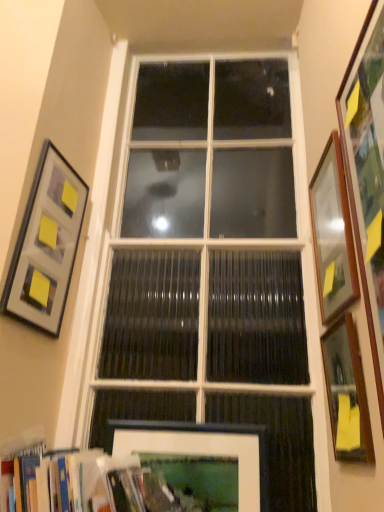
Question: Is wooden bookshelf at lower left placed right next to wooden framed mirror at right, the 2th picture frame viewed from the right?

Choices:
 (A) yes
 (B) no

Answer: (B)

Question: Is wooden bookshelf at lower left thinner than wooden framed mirror at right, the fourth picture frame in the left-to-right sequence?

Choices:
 (A) no
 (B) yes

Answer: (A)

Question: Is wooden bookshelf at lower left positioned before wooden framed mirror at right, the 2th picture frame viewed from the right?

Choices:
 (A) yes
 (B) no

Answer: (A)

Question: Is wooden bookshelf at lower left not inside wooden framed mirror at right, the fourth picture frame in the left-to-right sequence?

Choices:
 (A) yes
 (B) no

Answer: (A)

Question: Does wooden bookshelf at lower left appear on the right side of wooden framed mirror at right, the fourth picture frame in the left-to-right sequence?

Choices:
 (A) yes
 (B) no

Answer: (B)

Question: From a real-world perspective, relative to white glass window at center, is wooden picture frame at right, the third picture frame viewed from the left, vertically above or below?

Choices:
 (A) below
 (B) above

Answer: (A)

Question: From the image's perspective, is wooden picture frame at right, the third picture frame viewed from the left, above or below white glass window at center?

Choices:
 (A) below
 (B) above

Answer: (B)

Question: Considering the positions of wooden picture frame at right, the third picture frame viewed from the left, and white glass window at center in the image, is wooden picture frame at right, the third picture frame viewed from the left, wider or thinner than white glass window at center?

Choices:
 (A) thin
 (B) wide

Answer: (A)

Question: In the image, is wooden picture frame at right, the third picture frame viewed from the left, on the left side or the right side of white glass window at center?

Choices:
 (A) right
 (B) left

Answer: (A)

Question: Is wooden framed mirror at right, the 2th picture frame viewed from the right, taller or shorter than matte gray picture frame at upper left, arranged as the 5th picture frame when viewed from the right?

Choices:
 (A) short
 (B) tall

Answer: (A)

Question: Looking at their shapes, would you say wooden framed mirror at right, the 2th picture frame viewed from the right, is wider or thinner than matte gray picture frame at upper left, the first picture frame positioned from the left?

Choices:
 (A) thin
 (B) wide

Answer: (B)

Question: Considering the relative positions of wooden framed mirror at right, the 2th picture frame viewed from the right, and matte gray picture frame at upper left, arranged as the 5th picture frame when viewed from the right, in the image provided, is wooden framed mirror at right, the 2th picture frame viewed from the right, to the left or to the right of matte gray picture frame at upper left, arranged as the 5th picture frame when viewed from the right,?

Choices:
 (A) right
 (B) left

Answer: (A)

Question: Does point (331, 420) appear closer or farther from the camera than point (56, 176)?

Choices:
 (A) closer
 (B) farther

Answer: (A)

Question: Is point (6, 480) positioned closer to the camera than point (205, 433)?

Choices:
 (A) closer
 (B) farther

Answer: (A)

Question: Considering the positions of wooden bookshelf at lower left and white matte picture frame at lower center, the 2th picture frame when ordered from left to right, in the image, is wooden bookshelf at lower left wider or thinner than white matte picture frame at lower center, the 2th picture frame when ordered from left to right,?

Choices:
 (A) wide
 (B) thin

Answer: (A)